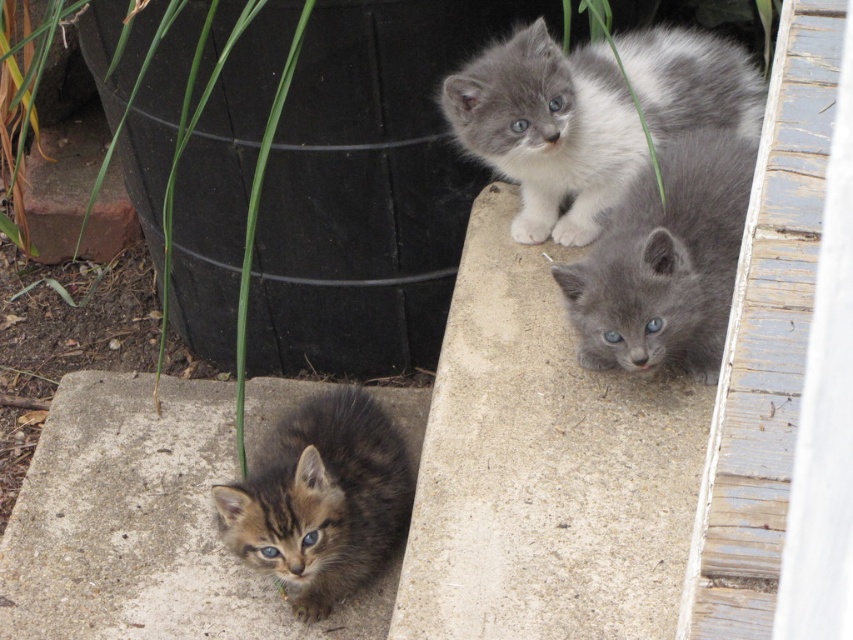
Question: Among these points, which one is nearest to the camera?

Choices:
 (A) (570, 320)
 (B) (608, 460)
 (C) (27, 582)

Answer: (B)

Question: Does gray concrete at upper center appear on the right side of tabby fur kitten at lower left?

Choices:
 (A) yes
 (B) no

Answer: (A)

Question: Is gray fluffy kitten at upper right wider than tabby fur kitten at lower left?

Choices:
 (A) no
 (B) yes

Answer: (B)

Question: Among these objects, which one is nearest to the camera?

Choices:
 (A) brown furry kitten at lower left
 (B) gray fluffy kitten at upper center
 (C) gray fluffy kitten at upper right

Answer: (C)

Question: Is gray fluffy kitten at upper right to the left of tabby fur kitten at lower left from the viewer's perspective?

Choices:
 (A) no
 (B) yes

Answer: (A)

Question: Based on their relative distances, which object is nearer to the gray fluffy kitten at upper right?

Choices:
 (A) tabby fur kitten at lower left
 (B) brown furry kitten at lower left
 (C) gray concrete at upper center

Answer: (C)